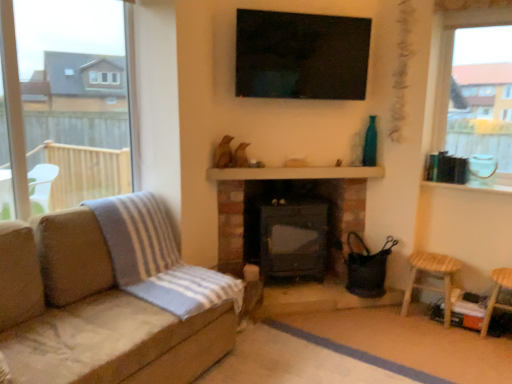
Question: Should I look upward or downward to see wooden balustrade at center?

Choices:
 (A) up
 (B) down

Answer: (A)

Question: Is clear glass window at upper right, which is counted as the 2th window, starting from the left, not near black glossy tv at upper center?

Choices:
 (A) yes
 (B) no

Answer: (B)

Question: Does clear glass window at upper right, the first window positioned from the right, have a greater height compared to black glossy tv at upper center?

Choices:
 (A) yes
 (B) no

Answer: (A)

Question: Is clear glass window at upper right, the first window positioned from the right, positioned before black glossy tv at upper center?

Choices:
 (A) yes
 (B) no

Answer: (A)

Question: Does clear glass window at upper right, which is counted as the 2th window, starting from the left, have a lesser width compared to black glossy tv at upper center?

Choices:
 (A) yes
 (B) no

Answer: (B)

Question: Would you say clear glass window at upper right, the first window positioned from the right, is outside black glossy tv at upper center?

Choices:
 (A) no
 (B) yes

Answer: (B)

Question: Is clear glass window at upper right, which is counted as the 2th window, starting from the left, bigger than black glossy tv at upper center?

Choices:
 (A) no
 (B) yes

Answer: (B)

Question: Is transparent glass window at left, marked as the first window in a left-to-right arrangement, to the left of wooden stool at lower right, which is counted as the second bar stool, starting from the right, from the viewer's perspective?

Choices:
 (A) no
 (B) yes

Answer: (B)

Question: Can you confirm if transparent glass window at left, the 2th window positioned from the right, is smaller than wooden stool at lower right, which is the first bar stool in left-to-right order?

Choices:
 (A) yes
 (B) no

Answer: (B)

Question: Is transparent glass window at left, marked as the first window in a left-to-right arrangement, outside wooden stool at lower right, which is counted as the second bar stool, starting from the right?

Choices:
 (A) no
 (B) yes

Answer: (B)

Question: Is transparent glass window at left, the 2th window positioned from the right, looking in the opposite direction of wooden stool at lower right, which is counted as the second bar stool, starting from the right?

Choices:
 (A) yes
 (B) no

Answer: (B)

Question: Is transparent glass window at left, marked as the first window in a left-to-right arrangement, thinner than wooden stool at lower right, which is counted as the second bar stool, starting from the right?

Choices:
 (A) no
 (B) yes

Answer: (B)

Question: Are transparent glass window at left, marked as the first window in a left-to-right arrangement, and wooden stool at lower right, which is counted as the second bar stool, starting from the right, far apart?

Choices:
 (A) no
 (B) yes

Answer: (B)

Question: Considering the relative sizes of wooden stool at lower right, which is counted as the second bar stool, starting from the right, and suede couch at left in the image provided, is wooden stool at lower right, which is counted as the second bar stool, starting from the right, shorter than suede couch at left?

Choices:
 (A) yes
 (B) no

Answer: (A)